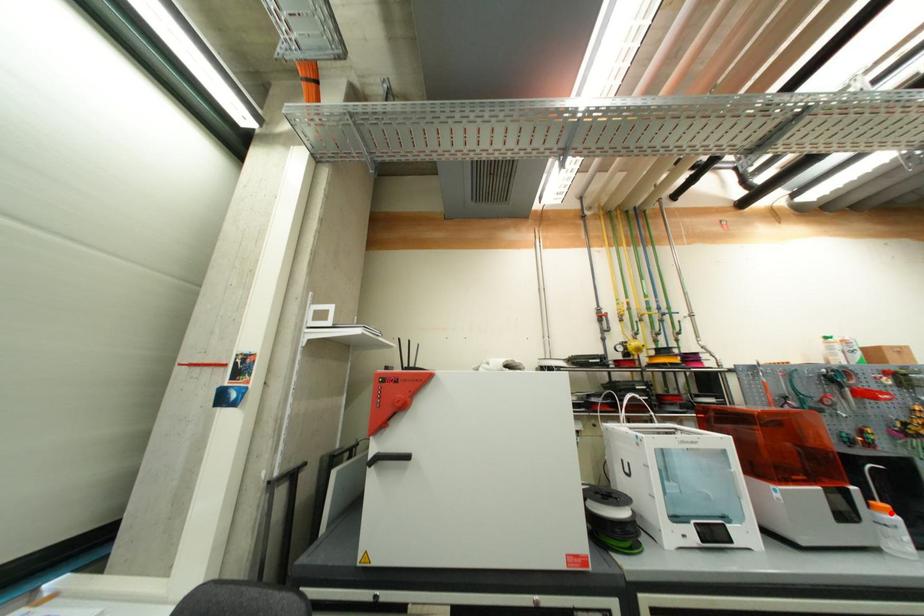
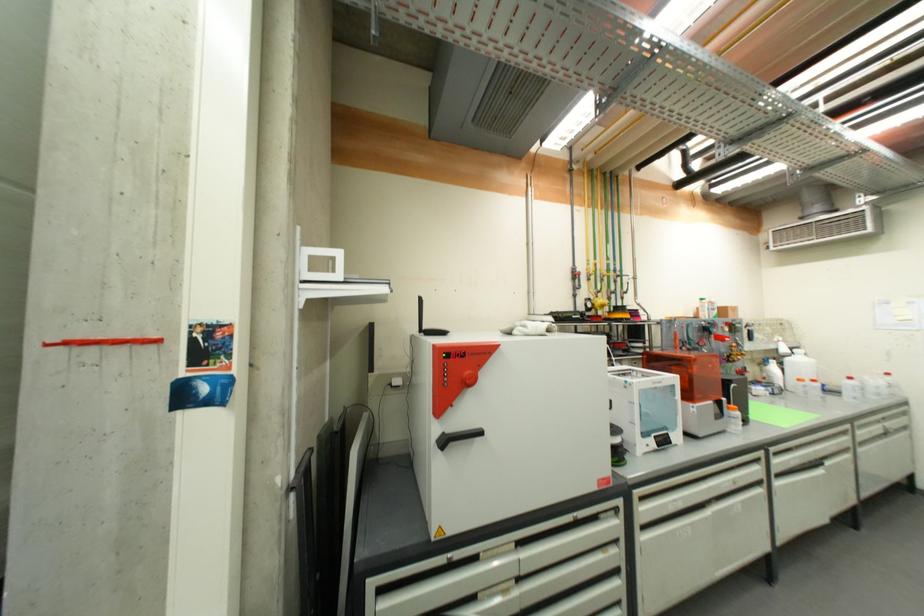
The point at the highlighted location is marked in the first image. Where is the corresponding point in the second image?

(739, 411)